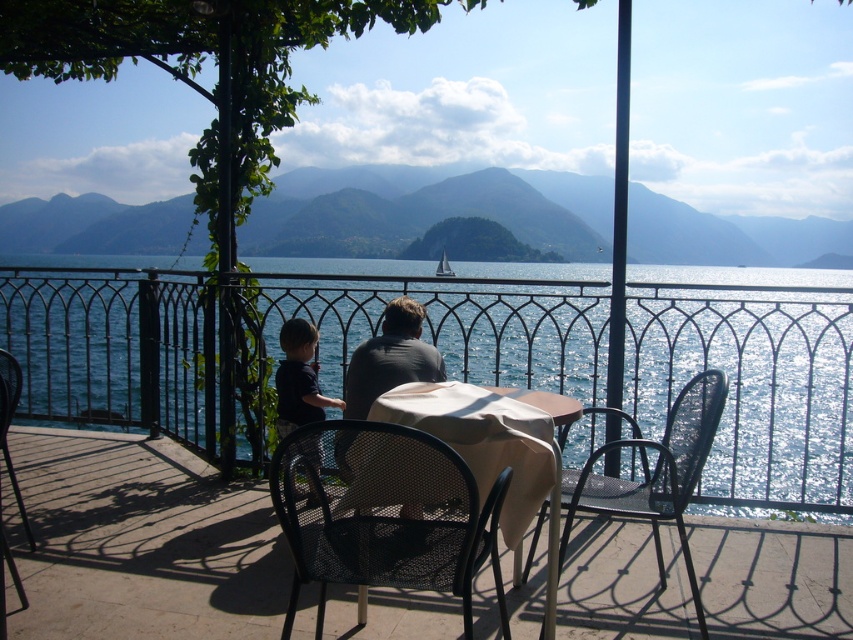
Does point (828, 609) lie in front of point (323, 420)?

No, it is behind (323, 420).

Between metal mesh table at center and black mesh chair at center, which one appears on the left side from the viewer's perspective?

metal mesh table at center

Locate an element on the screen. The width and height of the screenshot is (853, 640). metal mesh table at center is located at coordinates (142, 541).

Is metal mesh table at center thinner than gray fabric shirt at center?

No, metal mesh table at center is not thinner than gray fabric shirt at center.

How far apart are metal mesh table at center and gray fabric shirt at center?

A distance of 1.21 meters exists between metal mesh table at center and gray fabric shirt at center.

Who is more forward, (802, 566) or (367, 362)?

Point (802, 566) is in front.

This screenshot has height=640, width=853. Identify the location of metal mesh table at center. (142, 541).

Based on the photo, can you confirm if black mesh chair at center is bigger than black metal chair at right?

No, black mesh chair at center is not bigger than black metal chair at right.

Does black mesh chair at center appear on the right side of black metal chair at right?

Incorrect, black mesh chair at center is not on the right side of black metal chair at right.

Measure the distance between black mesh chair at center and camera.

The distance of black mesh chair at center from camera is 6.42 feet.

This screenshot has width=853, height=640. What are the coordinates of `black mesh chair at center` in the screenshot? It's located at (383, 513).